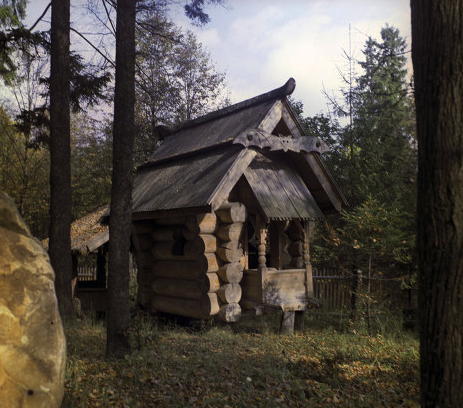
You are a GUI agent. You are given a task and a screenshot of the screen. Output one action in this format:
    pyautogui.click(x=<x>, y=<y>)
    Task: Click on the window
    This screenshot has width=463, height=408.
    Given the screenshot: What is the action you would take?
    pyautogui.click(x=181, y=240)